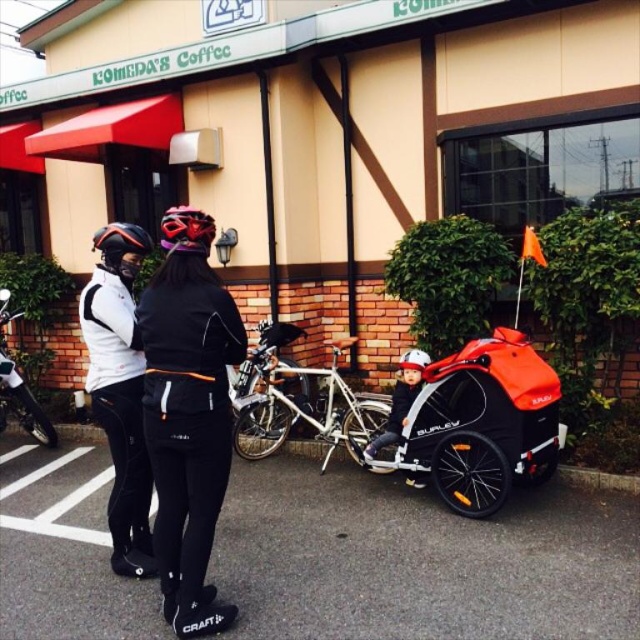
You are a delivery person who needs to load a package onto the silver metallic bicycle at center. The package requires that it must be placed above the matte black helmet at upper left. Can you do this based on the scene?

The silver metallic bicycle at center is taller than the matte black helmet at upper left, so yes, the package can be placed above the matte black helmet at upper left on the silver metallic bicycle at center.

You are a delivery person who needs to place a small package on the surface between the white matte jacket at center and the shiny silver bicycle at center. Which object should you place it closer to if you want the package to be more visible to someone approaching from the front?

The shiny silver bicycle at center is smaller than the white matte jacket at center, so placing the package closer to the shiny silver bicycle at center would make it more visible since it won

You are a delivery person who needs to load a package onto the shiny silver bicycle at center. The package is too large to fit under the white matte jacket at center. Where should you place the package?

The white matte jacket at center is above the shiny silver bicycle at center, so you should place the package below the white matte jacket at center on the shiny silver bicycle at center to avoid blocking it.